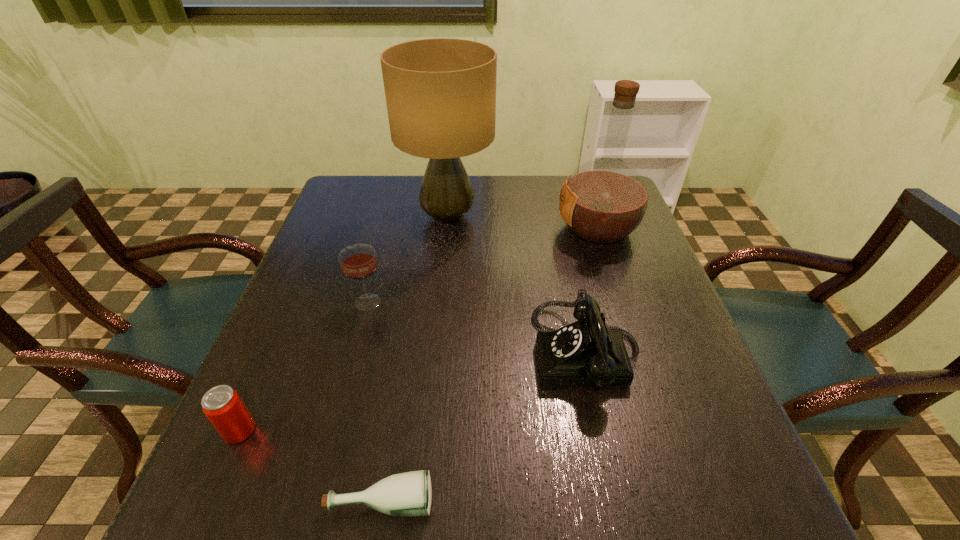
Identify the location of object that is at the near edge. This screenshot has width=960, height=540. (406, 494).

Find the location of `wineglass at the left edge`. wineglass at the left edge is located at coordinates (358, 262).

Find the location of a particular element. can located in the left edge section of the desktop is located at coordinates (222, 405).

You are a GUI agent. You are given a task and a screenshot of the screen. Output one action in this format:
    pyautogui.click(x=<x>, y=<y>)
    Task: Click on the liquor present at the right edge
    The image size is (960, 540).
    Given the screenshot: What is the action you would take?
    pyautogui.click(x=603, y=201)

Locate an element on the screen. The image size is (960, 540). telephone located in the right edge section of the desktop is located at coordinates (588, 352).

Find the location of `object that is at the far right corner`. object that is at the far right corner is located at coordinates pyautogui.click(x=603, y=201).

I want to click on free space at the far edge of the desktop, so click(x=399, y=198).

I want to click on free space at the near edge of the desktop, so click(432, 518).

Locate an element on the screen. The width and height of the screenshot is (960, 540). free space at the left edge of the desktop is located at coordinates (348, 306).

Image resolution: width=960 pixels, height=540 pixels. I want to click on vacant space at the right edge of the desktop, so click(618, 242).